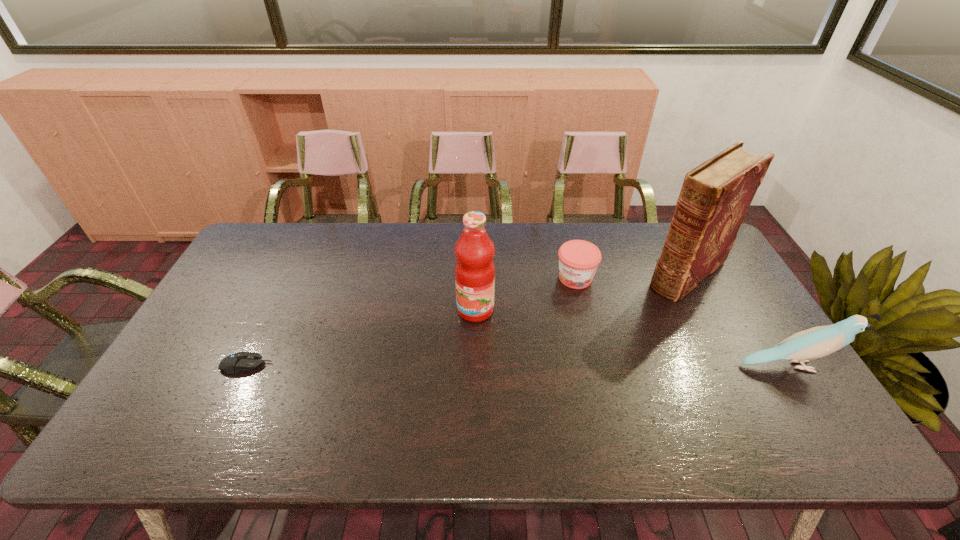
Identify the location of unoccupied area between the tallest object and the third tallest object. (739, 319).

Where is `vacant region between the bird and the jam`? This screenshot has height=540, width=960. vacant region between the bird and the jam is located at coordinates (684, 322).

This screenshot has height=540, width=960. I want to click on vacant point located between the fourth object from right to left and the third object from right to left, so click(x=525, y=294).

What are the coordinates of `unoccupied area between the computer mouse and the second object from left to right` in the screenshot? It's located at (361, 338).

At what (x,y) coordinates should I click in order to perform the action: click on object that is the fourth closest to the hardback book. Please return your answer as a coordinate pair (x, y). This screenshot has width=960, height=540. Looking at the image, I should click on (237, 362).

You are a GUI agent. You are given a task and a screenshot of the screen. Output one action in this format:
    pyautogui.click(x=<x>, y=<y>)
    Task: Click on the object that stands as the second closest to the second tallest object
    The width and height of the screenshot is (960, 540).
    Given the screenshot: What is the action you would take?
    pyautogui.click(x=716, y=195)

Locate an element on the screen. The width and height of the screenshot is (960, 540). vacant space that satisfies the following two spatial constraints: 1. on the front side of the third tallest object; 2. at the face of the second tallest object is located at coordinates (475, 366).

The height and width of the screenshot is (540, 960). Find the location of `free point that satisfies the following two spatial constraints: 1. on the back side of the tallest object; 2. on the right side of the jam`. free point that satisfies the following two spatial constraints: 1. on the back side of the tallest object; 2. on the right side of the jam is located at coordinates (574, 273).

Image resolution: width=960 pixels, height=540 pixels. What are the coordinates of `vacant region that satisfies the following two spatial constraints: 1. on the back side of the fourth tallest object; 2. on the left side of the tallest object` in the screenshot? It's located at (574, 273).

In order to click on vacant area in the image that satisfies the following two spatial constraints: 1. on the front side of the third shortest object; 2. at the face of the shortest object in this screenshot , I will do `click(246, 366)`.